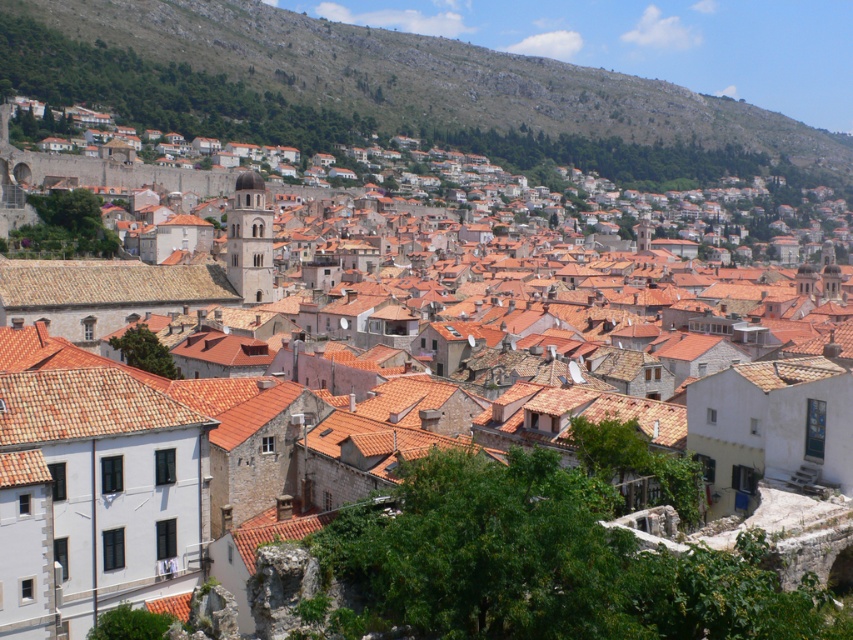
You are standing at the point marked by coordinates point (430,76) in this urban area. Looking around, you see the green grassy hillside at upper left. Based on your location, which direction would you face to look towards the center of the city?

Since the point (430,76) is located at the green grassy hillside at upper left, facing south would direct you towards the center of the city.

You are an urban planner evaluating the space between the green grassy hillside at upper left and the brown tile roof at center. Based on the scene, which object occupies a larger horizontal space in the image?

The green grassy hillside at upper left might be wider than the brown tile roof at center according to the description.